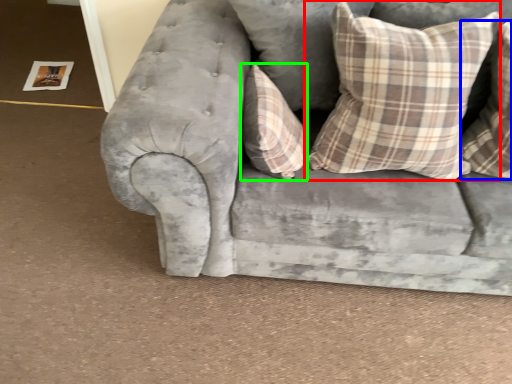
Question: Based on their relative distances, which object is nearer to pillow (highlighted by a red box)? Choose from pillow (highlighted by a blue box) and pillow (highlighted by a green box).

Choices:
 (A) pillow
 (B) pillow

Answer: (A)